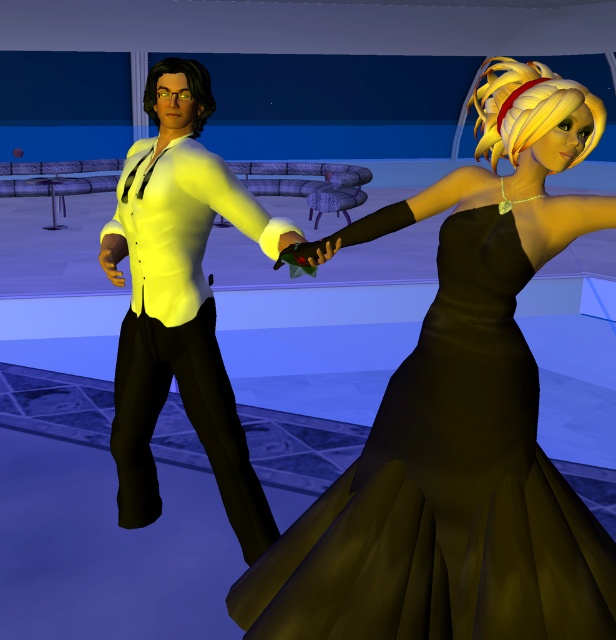
Question: Which point is closer to the camera taking this photo?

Choices:
 (A) (139, 280)
 (B) (537, 444)

Answer: (B)

Question: Can you confirm if black satin dress at center is positioned to the right of matte yellow shirt at center?

Choices:
 (A) no
 (B) yes

Answer: (B)

Question: Is black satin dress at center positioned at the back of matte yellow shirt at center?

Choices:
 (A) yes
 (B) no

Answer: (B)

Question: Which point appears closest to the camera in this image?

Choices:
 (A) (381, 220)
 (B) (156, 285)

Answer: (A)

Question: Does black satin dress at center have a smaller size compared to matte yellow shirt at center?

Choices:
 (A) no
 (B) yes

Answer: (B)